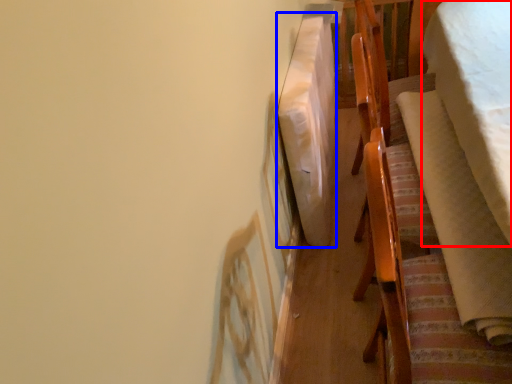
Question: Among these objects, which one is nearest to the camera, blanket (highlighted by a red box) or blanket (highlighted by a blue box)?

Choices:
 (A) blanket
 (B) blanket

Answer: (A)